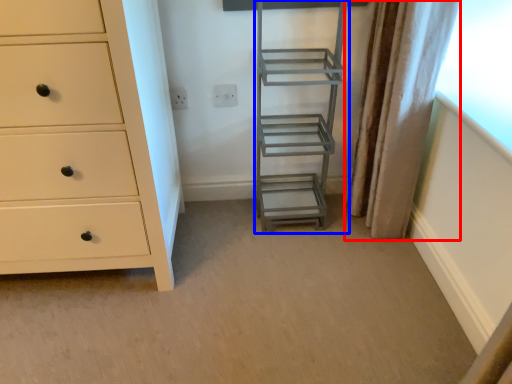
Question: Which object appears closest to the camera in this image, curtain (highlighted by a red box) or ladder (highlighted by a blue box)?

Choices:
 (A) curtain
 (B) ladder

Answer: (A)